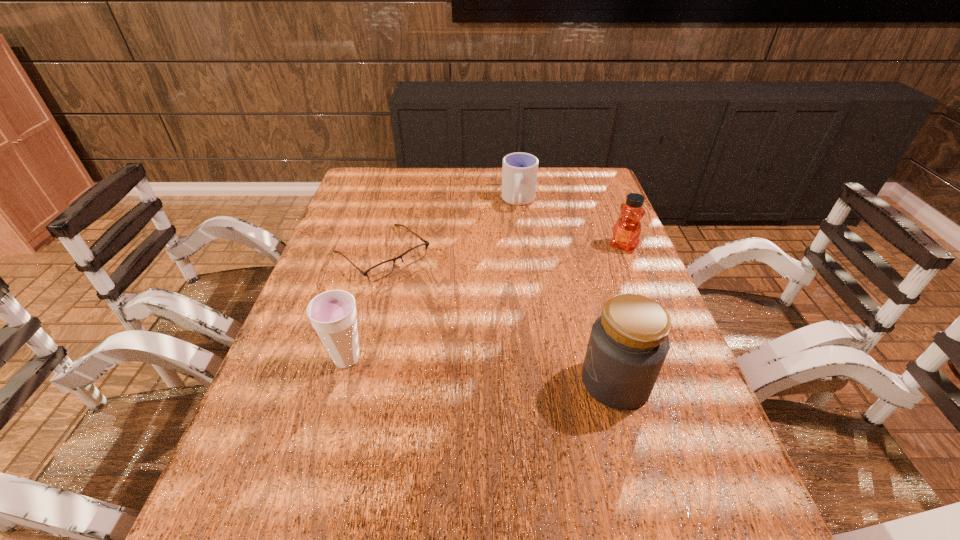
Find the location of a particular element. This screenshot has width=960, height=540. vacant space at the far right corner of the desktop is located at coordinates (586, 166).

You are a GUI agent. You are given a task and a screenshot of the screen. Output one action in this format:
    pyautogui.click(x=<x>, y=<y>)
    Task: Click on the free space between the shortest object and the second object from right to left
    
    Given the screenshot: What is the action you would take?
    pyautogui.click(x=499, y=318)

Where is `vacant space that is in between the farthest object and the nearer cup`? vacant space that is in between the farthest object and the nearer cup is located at coordinates (433, 280).

At what (x,y) coordinates should I click in order to perform the action: click on empty location between the farther cup and the spectacles. Please return your answer as a coordinate pair (x, y). Looking at the image, I should click on pos(450,228).

Where is `free spot between the right cup and the taller cup`? This screenshot has height=540, width=960. free spot between the right cup and the taller cup is located at coordinates (433, 280).

The height and width of the screenshot is (540, 960). Find the location of `free space between the farthest object and the shortest object`. free space between the farthest object and the shortest object is located at coordinates (450, 228).

Locate an element on the screen. free space between the left cup and the fourth object from left to right is located at coordinates (481, 370).

The image size is (960, 540). Identify the location of empty location between the fourth object from left to right and the taller cup. (481, 370).

Identify the location of object that ranks as the fourth closest to the fourth object from left to right. (519, 172).

Choose which object is the second nearest neighbor to the shortest object. Please provide its 2D coordinates. Your answer should be formatted as a tuple, i.e. [(x, y)], where the tuple contains the x and y coordinates of a point satisfying the conditions above.

[(519, 172)]